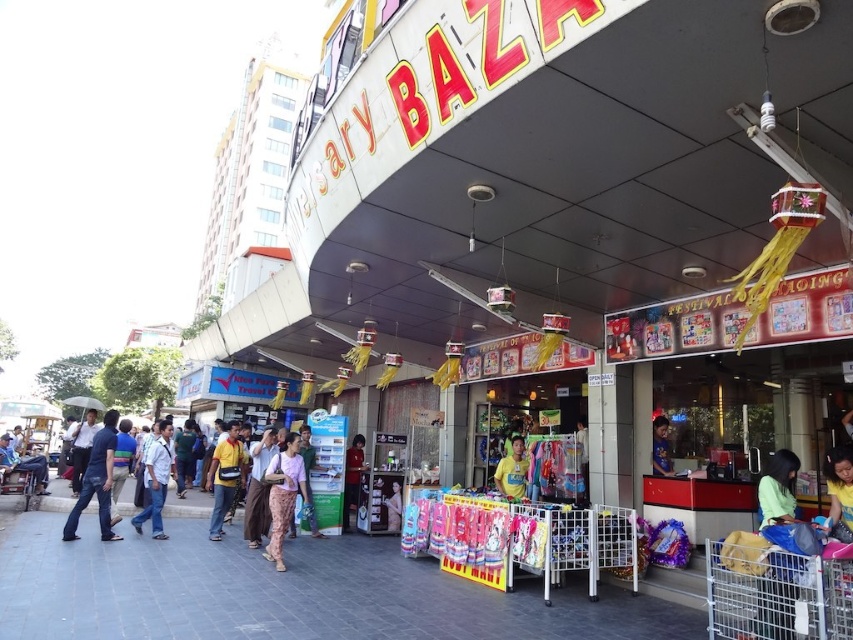
Question: Based on their relative distances, which object is farther from the matte yellow shirt at center?

Choices:
 (A) yellow fabric shirt at center
 (B) blue jeans at left

Answer: (A)

Question: Does light brown fabric shirt at center have a larger size compared to light purple fabric pants at center?

Choices:
 (A) yes
 (B) no

Answer: (A)

Question: Among these points, which one is farthest from the camera?

Choices:
 (A) (242, 474)
 (B) (24, 456)
 (C) (144, 464)

Answer: (B)

Question: Which is nearer to the light blue shirt at left?

Choices:
 (A) yellow fabric bag at center
 (B) light purple fabric at center
 (C) yellow fabric shirt at center

Answer: (A)

Question: Is light purple fabric pants at center thinner than light blue shirt at left?

Choices:
 (A) yes
 (B) no

Answer: (A)

Question: Can you confirm if light purple fabric pants at center is bigger than blue fabric shirt at center?

Choices:
 (A) no
 (B) yes

Answer: (B)